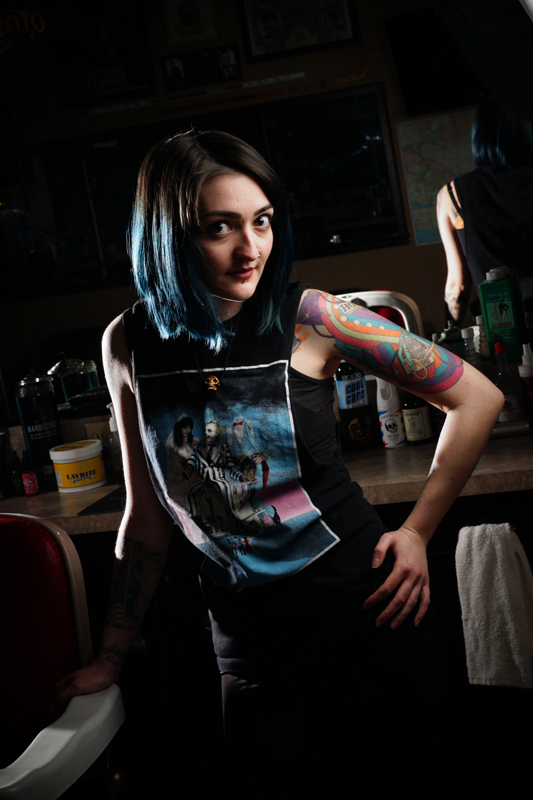
What are the coordinates of `white towel` in the screenshot? It's located at (479, 600).